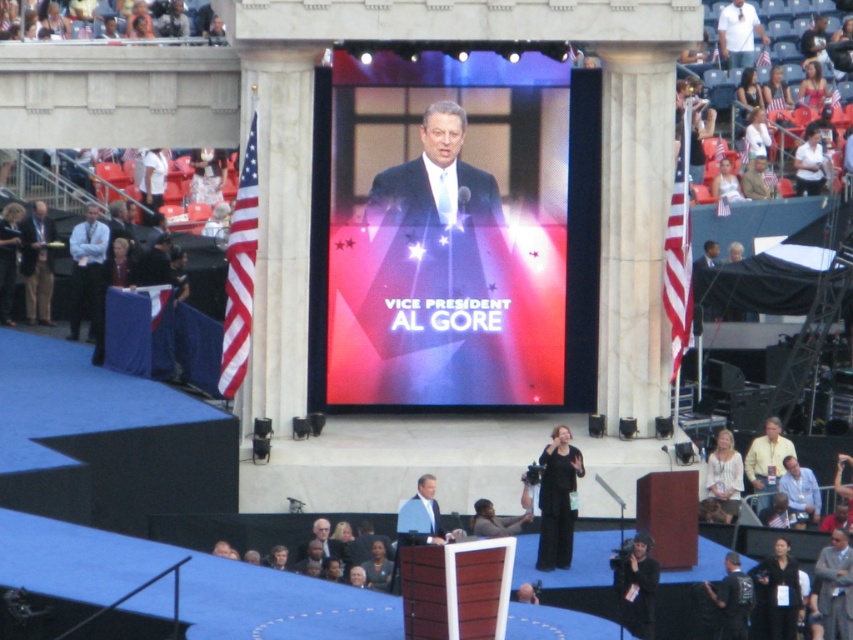
You are attending a political event and see the matte blue shirt at left and the blue fabric at center. Which object is positioned more to the left?

The matte blue shirt at left is positioned more to the left than the blue fabric at center.